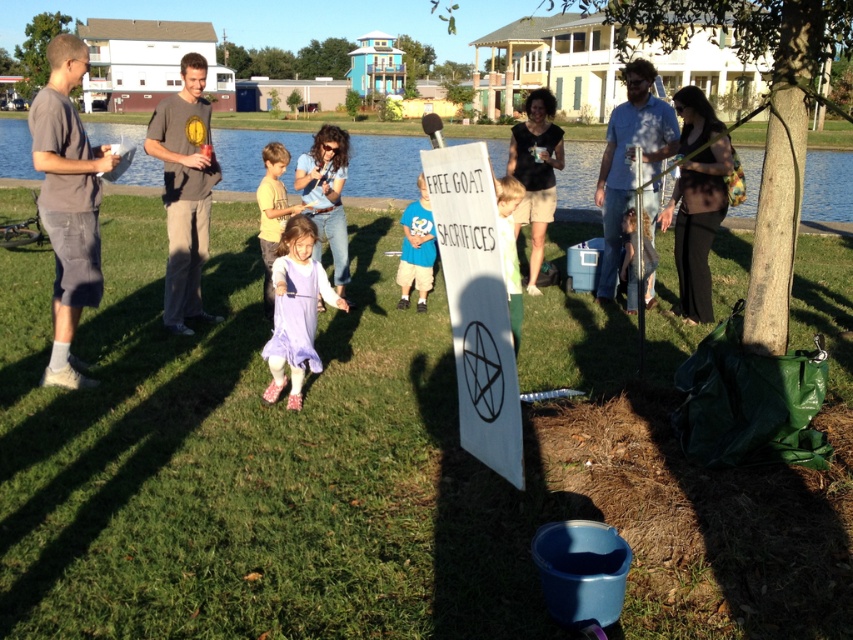
You are organizing a community event and need to arrange seating for participants. Given the blue denim shirt at center and the blue cotton shirt at center, which one would you choose to place on a chair that requires a larger seat cushion?

The blue denim shirt at center has a larger size compared to the blue cotton shirt at center, so it would require a larger seat cushion. Therefore, you should place the blue denim shirt at center on the chair with the larger seat cushion.